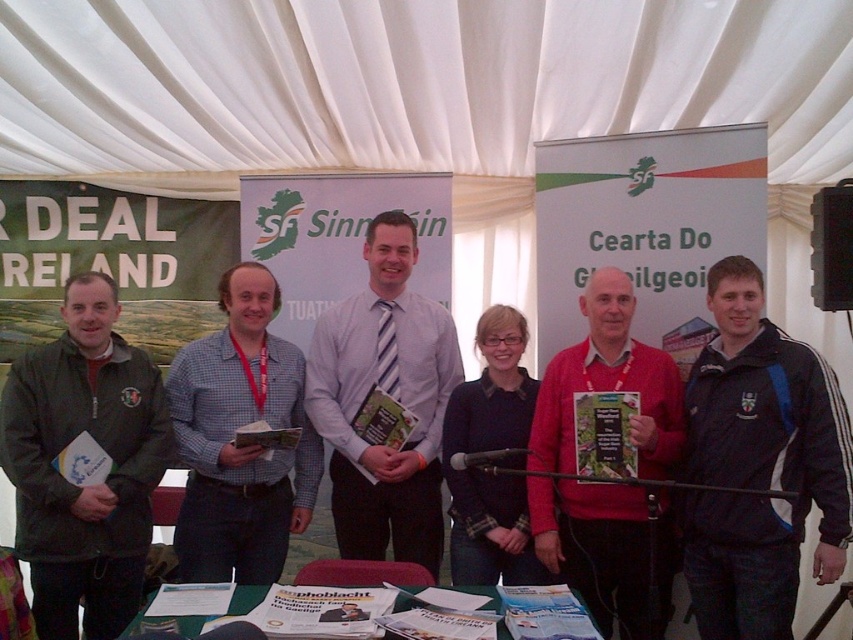
Question: In this image, where is green matte jacket at left located relative to checkered fabric shirt at center?

Choices:
 (A) right
 (B) left

Answer: (B)

Question: Is green matte jacket at left wider than light blue shirt with tie at center?

Choices:
 (A) yes
 (B) no

Answer: (B)

Question: Which point is closer to the camera taking this photo?

Choices:
 (A) (68, 380)
 (B) (270, 524)
 (C) (476, 589)

Answer: (C)

Question: Can you confirm if red matte sweater at center is thinner than green fabric table at lower center?

Choices:
 (A) no
 (B) yes

Answer: (B)

Question: Which of the following is the closest to the observer?

Choices:
 (A) (633, 502)
 (B) (44, 376)
 (C) (230, 604)
 (D) (221, 460)

Answer: (C)

Question: Among these objects, which one is farthest from the camera?

Choices:
 (A) dark blue jacket at center
 (B) green fabric table at lower center

Answer: (A)